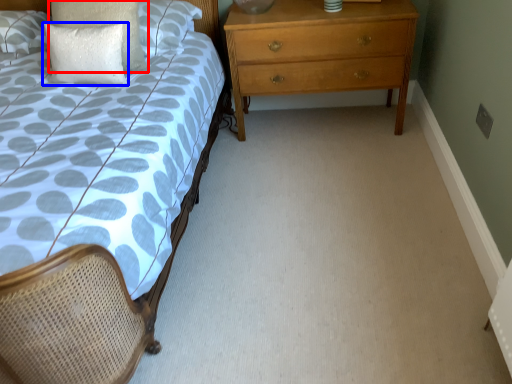
Question: Which object is further to the camera taking this photo, pillow (highlighted by a red box) or pillow (highlighted by a blue box)?

Choices:
 (A) pillow
 (B) pillow

Answer: (A)